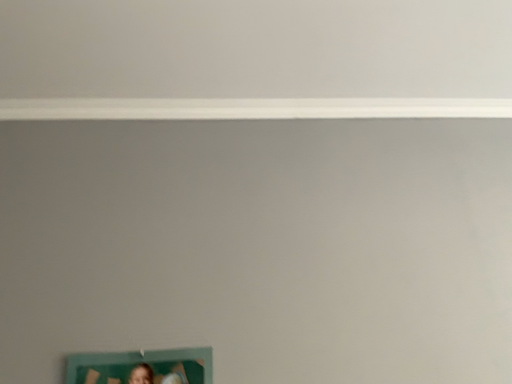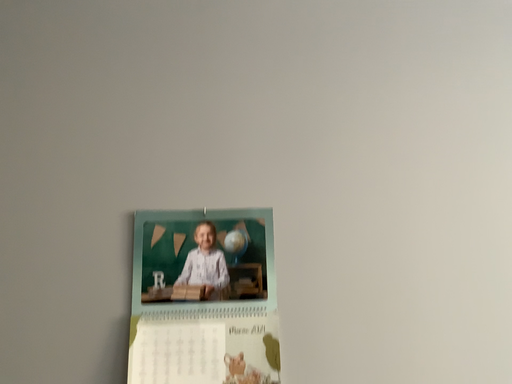
Question: How did the camera likely rotate when shooting the video?

Choices:
 (A) rotated upward
 (B) rotated downward

Answer: (B)